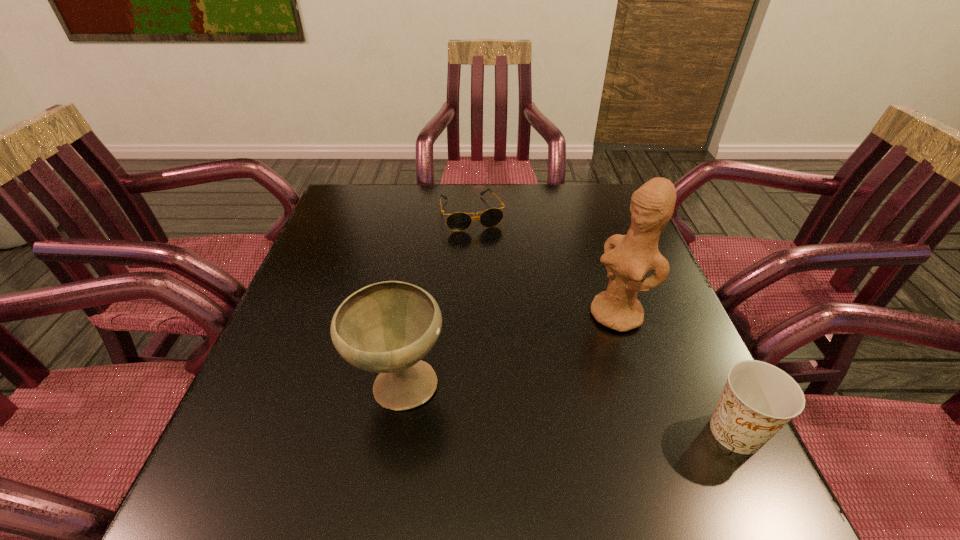
You are a GUI agent. You are given a task and a screenshot of the screen. Output one action in this format:
    pyautogui.click(x=<x>, y=<y>)
    Task: Click on the vacant space on the desktop that is between the third shortest object and the rightmost object and is positioned on the front-facing side of the tallest object
    
    Given the screenshot: What is the action you would take?
    pyautogui.click(x=512, y=401)

At what (x,y) coordinates should I click in order to perform the action: click on vacant space on the desktop that is between the chalice and the rightmost object and is positioned on the lenses of the shortest object. Please return your answer as a coordinate pair (x, y). The height and width of the screenshot is (540, 960). Looking at the image, I should click on (543, 406).